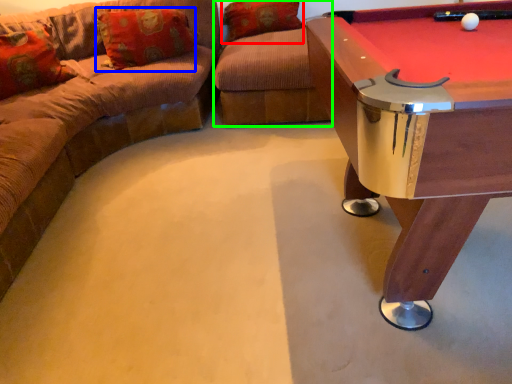
Question: Based on their relative distances, which object is nearer to pillow (highlighted by a red box)? Choose from pillow (highlighted by a blue box) and swivel chair (highlighted by a green box).

Choices:
 (A) pillow
 (B) swivel chair

Answer: (B)